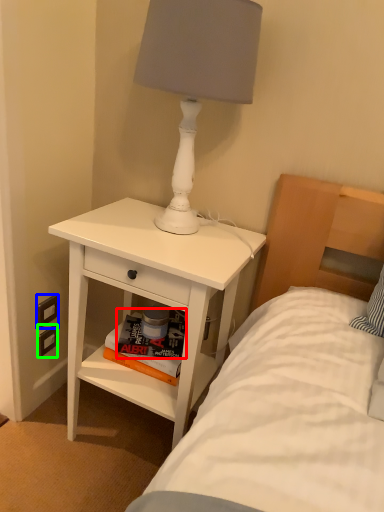
Question: Considering the real-world distances, which object is closest to magazine (highlighted by a red box)? electric outlet (highlighted by a blue box) or electric outlet (highlighted by a green box).

Choices:
 (A) electric outlet
 (B) electric outlet

Answer: (A)